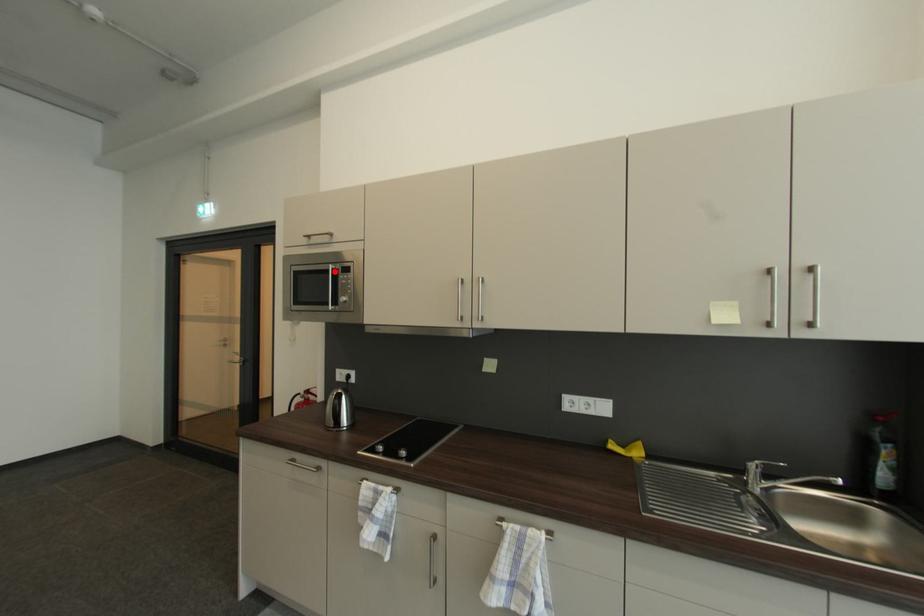
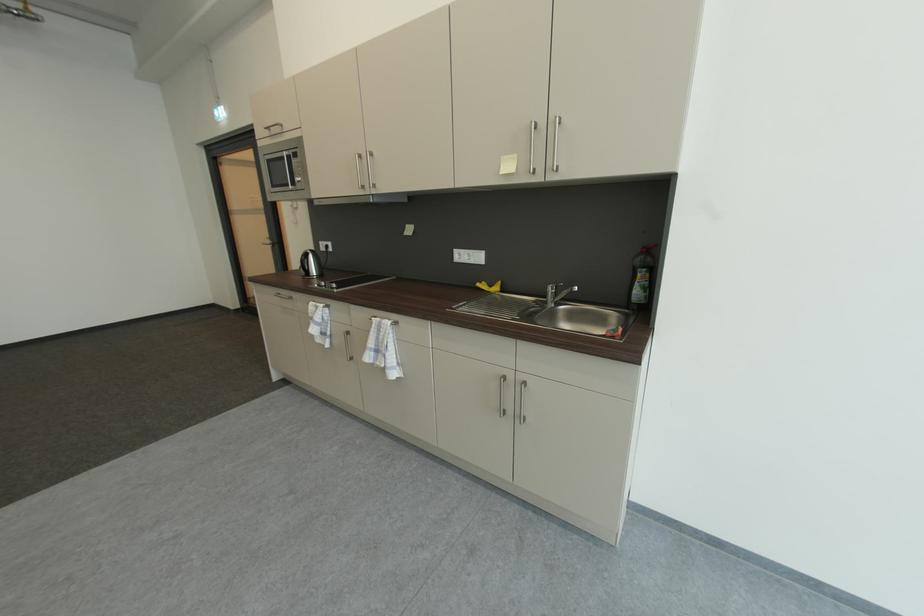
Question: I am providing you with two images of the same scene from different viewpoints. A red point is marked on the first image. Is the red point's position out of view in image 2?

Choices:
 (A) Yes
 (B) No

Answer: (B)